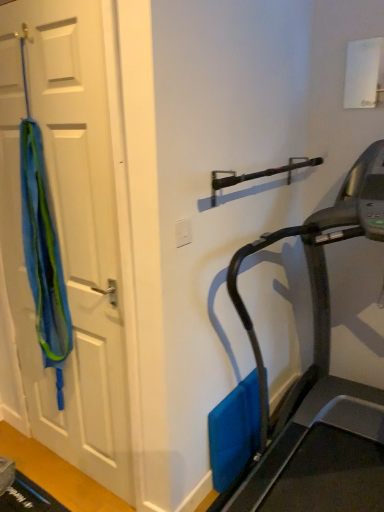
Question: From a real-world perspective, relative to blue fabric at left, is white plastic electric outlet at center vertically above or below?

Choices:
 (A) above
 (B) below

Answer: (A)

Question: Considering the relative positions of white plastic electric outlet at center and blue fabric at left in the image provided, is white plastic electric outlet at center to the left or to the right of blue fabric at left?

Choices:
 (A) left
 (B) right

Answer: (B)

Question: Based on their relative distances, which object is nearer to the white plastic electric outlet at center?

Choices:
 (A) black metallic door handle at upper center
 (B) blue fabric at left
 (C) blue fabric at left

Answer: (A)

Question: Based on their relative distances, which object is farther from the black metallic door handle at upper center?

Choices:
 (A) white plastic electric outlet at center
 (B) blue fabric at left
 (C) blue fabric at left

Answer: (C)